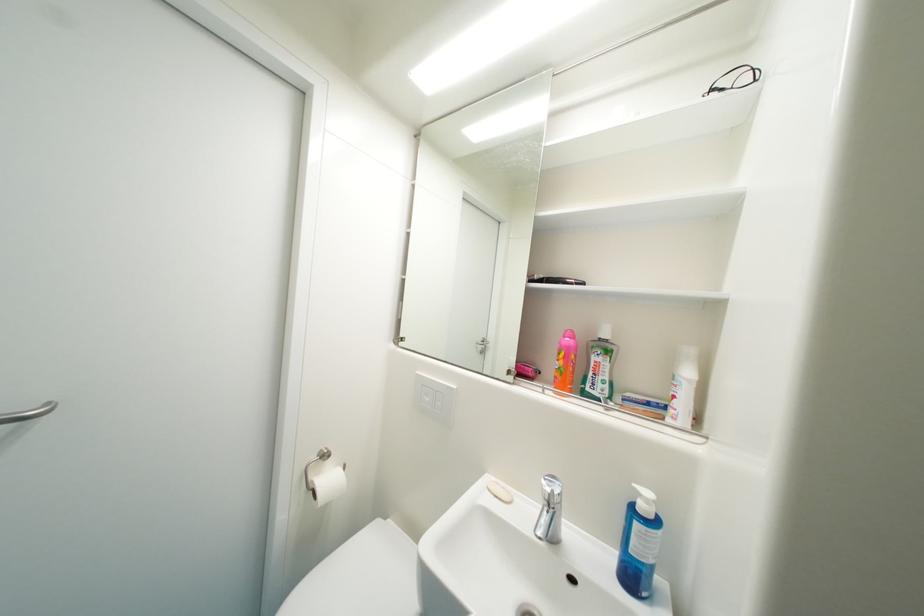
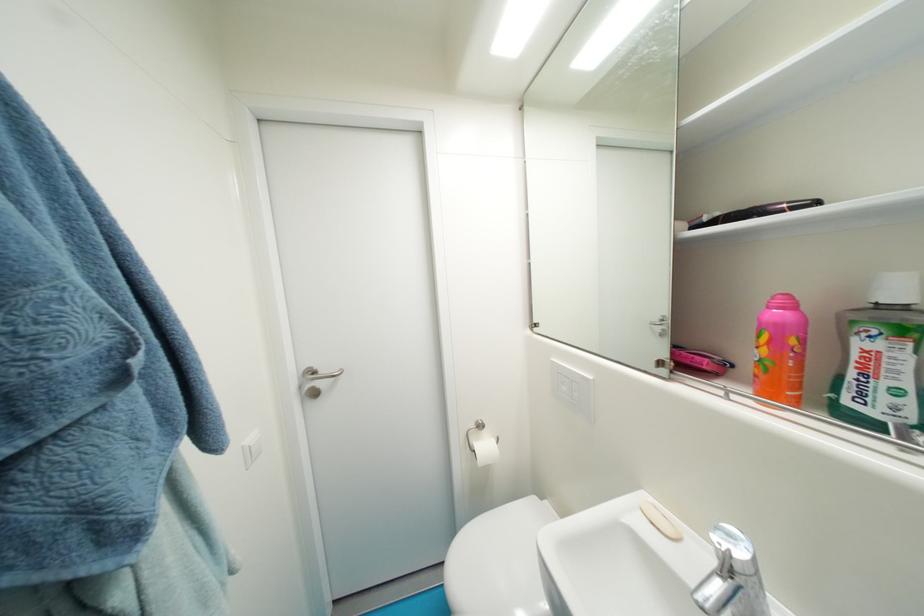
Locate, in the second image, the point that corresponds to the point at 569,371 in the first image.

(774, 363)